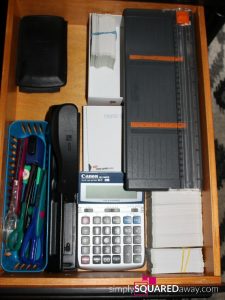
Identify the location of screen. This screenshot has width=225, height=300. click(104, 190).